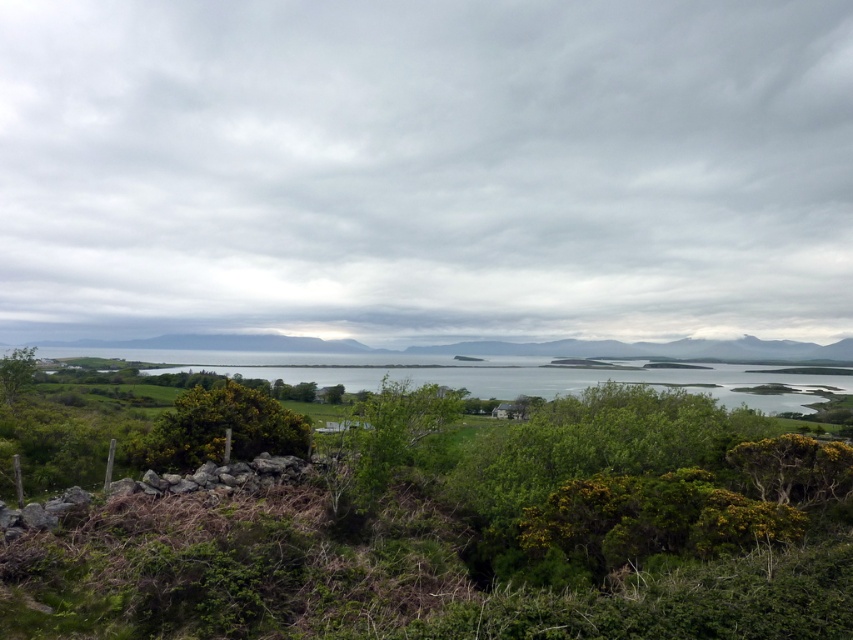
You are standing at the center of the scene and want to reach both the green leafy shrubs at center and the green leafy bush at center. Which one is closer to you?

Both the green leafy shrubs at center and the green leafy bush at center are at the same distance from you since they are both located at the center of the scene.

You are standing in the middle of the landscape and want to take a photo of the gray cloudy sky at upper center without any obstruction. Are the green leafy shrubs at center blocking your view?

The green leafy shrubs at center are behind the gray cloudy sky at upper center, so they are not blocking the view of the gray cloudy sky at upper center. You can take the photo without any obstruction.